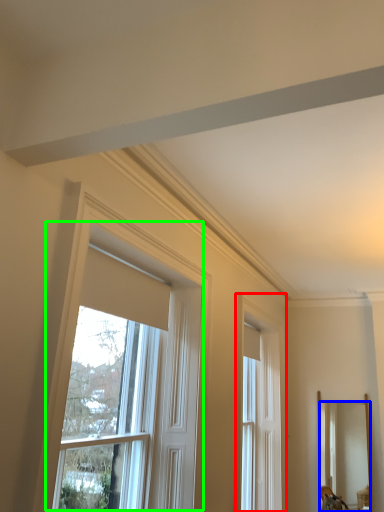
Question: Based on their relative distances, which object is nearer to window (highlighted by a red box)? Choose from mirror (highlighted by a blue box) and window (highlighted by a green box).

Choices:
 (A) mirror
 (B) window

Answer: (A)